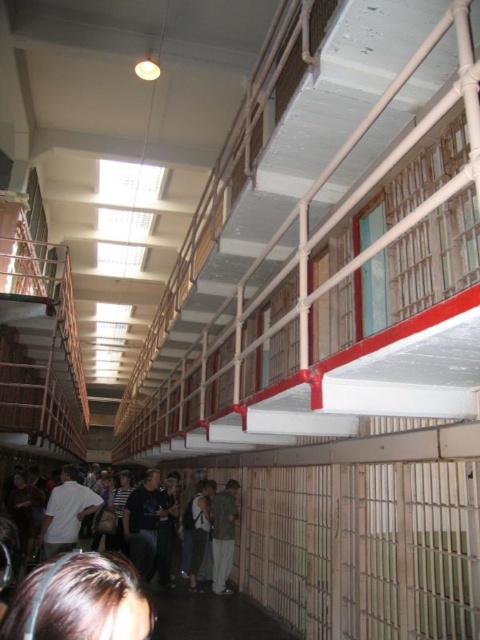
Is point (72, 518) farther from camera compared to point (194, 529)?

No, it is not.

Does white matte shirt at lower left have a smaller size compared to dark gray fabric pants at center?

Incorrect, white matte shirt at lower left is not smaller in size than dark gray fabric pants at center.

Is point (48, 520) positioned before point (202, 561)?

Yes, it is.

Identify the location of white matte shirt at lower left. (66, 513).

Does dark brown leather jacket at lower left come behind green fabric jacket at center?

No.

How distant is dark brown leather jacket at lower left from green fabric jacket at center?

The distance of dark brown leather jacket at lower left from green fabric jacket at center is 7.72 meters.

Describe the element at coordinates (80, 600) in the screenshot. Image resolution: width=480 pixels, height=640 pixels. I see `dark brown leather jacket at lower left` at that location.

At what (x,y) coordinates should I click in order to perform the action: click on dark brown leather jacket at lower left. Please return your answer as a coordinate pair (x, y). The image size is (480, 640). Looking at the image, I should click on (80, 600).

Does brown hair at lower left have a lesser width compared to green fabric jacket at center?

Correct, brown hair at lower left's width is less than green fabric jacket at center's.

Is point (112, 612) farther from camera compared to point (227, 484)?

No, (112, 612) is in front of (227, 484).

The width and height of the screenshot is (480, 640). What are the coordinates of `brown hair at lower left` in the screenshot? It's located at (80, 600).